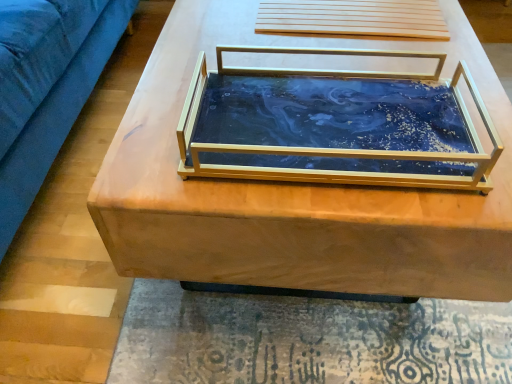
Where is `vacant area situated below marble-like blue tray at center (from a real-world perspective)`? This screenshot has width=512, height=384. vacant area situated below marble-like blue tray at center (from a real-world perspective) is located at coordinates (330, 123).